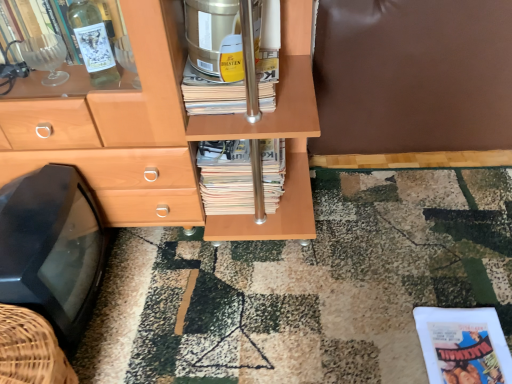
Question: Choose the correct answer: Is stacked paper magazine at center inside gold metallic canister at center or outside it?

Choices:
 (A) outside
 (B) inside

Answer: (A)

Question: In terms of size, does stacked paper magazine at center appear bigger or smaller than gold metallic canister at center?

Choices:
 (A) big
 (B) small

Answer: (A)

Question: Estimate the real-world distances between objects in this image. Which object is closer to the gold metallic canister at center?

Choices:
 (A) stacked paper magazine at center
 (B) matte white paperback book at lower right
 (C) black plastic tv at lower left

Answer: (A)

Question: Estimate the real-world distances between objects in this image. Which object is farther from the gold metallic canister at center?

Choices:
 (A) stacked paper magazine at center
 (B) matte white paperback book at lower right
 (C) black plastic tv at lower left

Answer: (B)